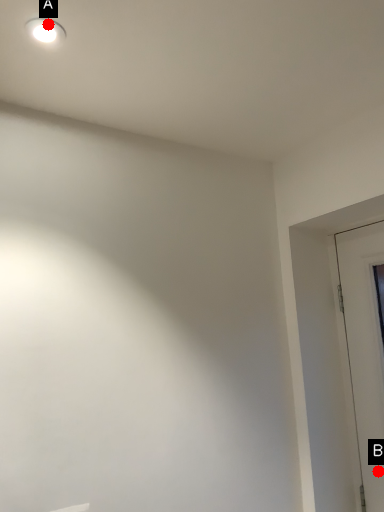
Question: Two points are circled on the image, labeled by A and B beside each circle. Which point is further to the camera?

Choices:
 (A) A is further
 (B) B is further

Answer: (B)